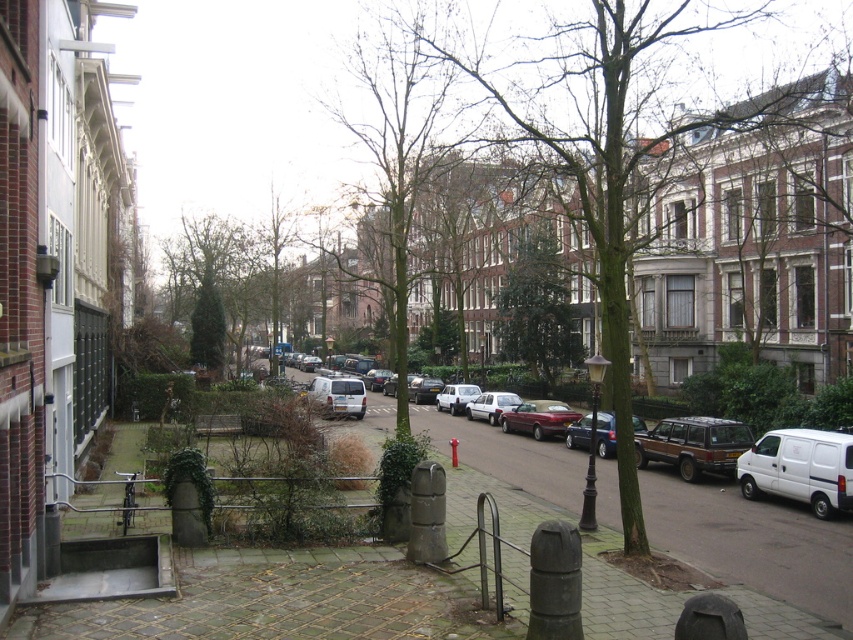
Does rusty metallic suv at center-right have a lesser width compared to shiny maroon sedan at center?

Yes.

Does rusty metallic suv at center-right have a greater width compared to shiny maroon sedan at center?

No, rusty metallic suv at center-right is not wider than shiny maroon sedan at center.

The image size is (853, 640). Describe the element at coordinates (694, 444) in the screenshot. I see `rusty metallic suv at center-right` at that location.

Image resolution: width=853 pixels, height=640 pixels. I want to click on rusty metallic suv at center-right, so click(x=694, y=444).

Is brown textured tree at center in front of green glossy tree at center?

Yes, it is in front of green glossy tree at center.

Is brown textured tree at center smaller than green glossy tree at center?

Incorrect, brown textured tree at center is not smaller in size than green glossy tree at center.

Between point (663, 244) and point (527, 344), which one is positioned behind?

Point (527, 344)

Where is `brown textured tree at center`? This screenshot has height=640, width=853. brown textured tree at center is located at coordinates (637, 141).

Who is positioned more to the right, rusty metallic suv at center-right or silver metallic sedan at center?

rusty metallic suv at center-right

Consider the image. How distant is rusty metallic suv at center-right from silver metallic sedan at center?

rusty metallic suv at center-right is 14.29 meters from silver metallic sedan at center.

Image resolution: width=853 pixels, height=640 pixels. What are the coordinates of `rusty metallic suv at center-right` in the screenshot? It's located at (694, 444).